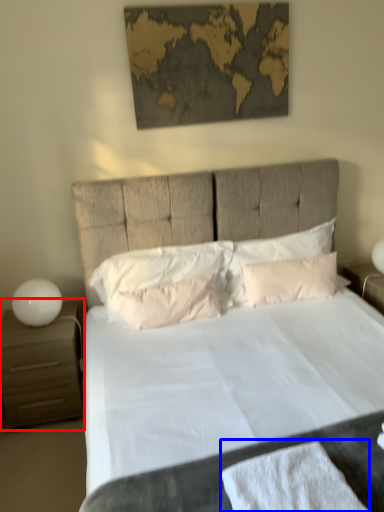
Question: Which point is closer to the camera, nightstand (highlighted by a red box) or bath towel (highlighted by a blue box)?

Choices:
 (A) nightstand
 (B) bath towel

Answer: (B)